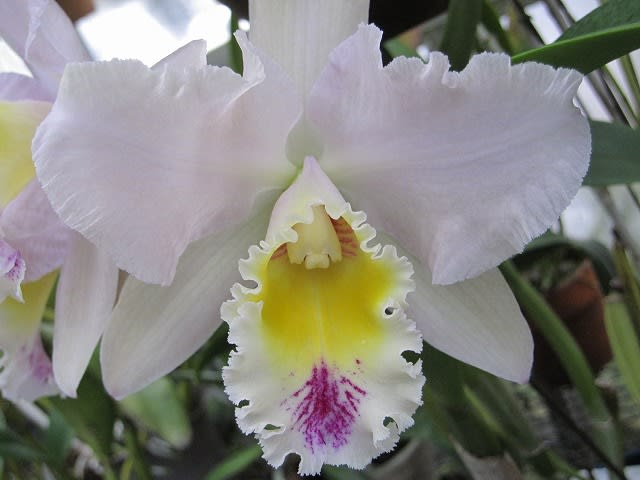
Where is `plant pots`? This screenshot has height=480, width=640. plant pots is located at coordinates (589, 293), (390, 469).